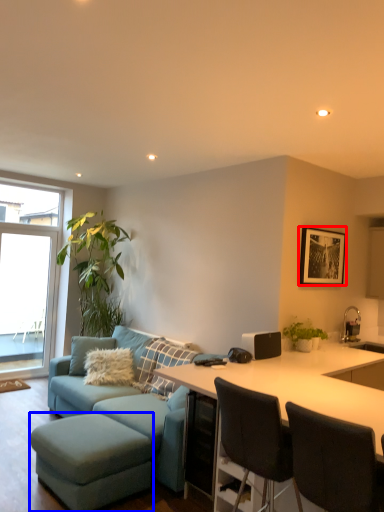
Question: Which object is further to the camera taking this photo, picture frame (highlighted by a red box) or bar stool (highlighted by a blue box)?

Choices:
 (A) picture frame
 (B) bar stool

Answer: (A)